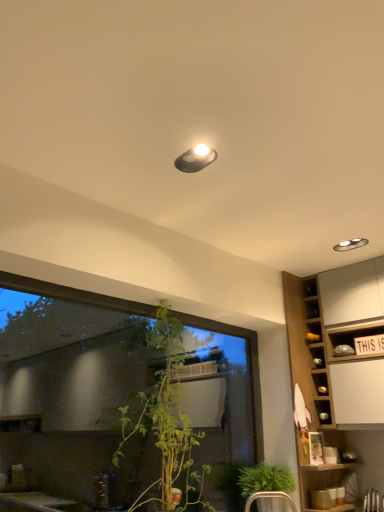
Question: Considering their positions, is transparent glass window at center located in front of or behind wooden cabinet at right?

Choices:
 (A) behind
 (B) front

Answer: (B)

Question: From their relative heights in the image, would you say transparent glass window at center is taller or shorter than wooden cabinet at right?

Choices:
 (A) short
 (B) tall

Answer: (A)

Question: Which object is positioned farthest from the wooden cabinet at right?

Choices:
 (A) metallic silver armchair at lower center
 (B) green leafy plant at lower center
 (C) transparent glass window at center
 (D) matte black light fixture at upper center

Answer: (D)

Question: Considering the real-world distances, which object is farthest from the wooden cabinet at right?

Choices:
 (A) green leafy plant at lower center
 (B) metallic silver armchair at lower center
 (C) matte black light fixture at upper center
 (D) transparent glass window at center

Answer: (C)